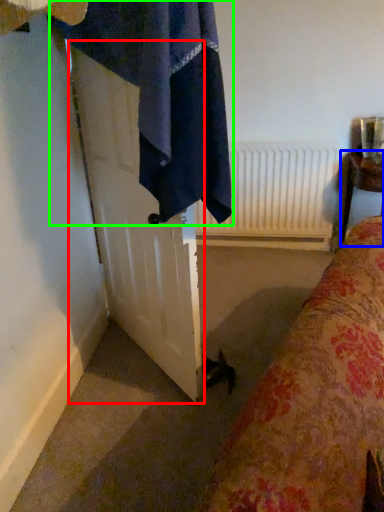
Question: Which object is positioned closest to screen door (highlighted by a red box)? Select from furniture (highlighted by a blue box) and bath towel (highlighted by a green box).

Choices:
 (A) furniture
 (B) bath towel

Answer: (B)